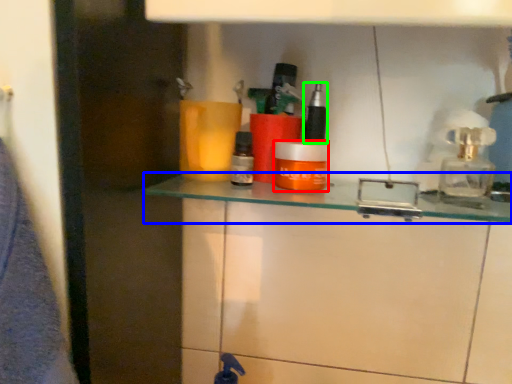
Question: Based on their relative distances, which object is farther from mouthwash (highlighted by a red box)? Choose from shelf (highlighted by a blue box) and toiletry (highlighted by a green box).

Choices:
 (A) shelf
 (B) toiletry

Answer: (B)